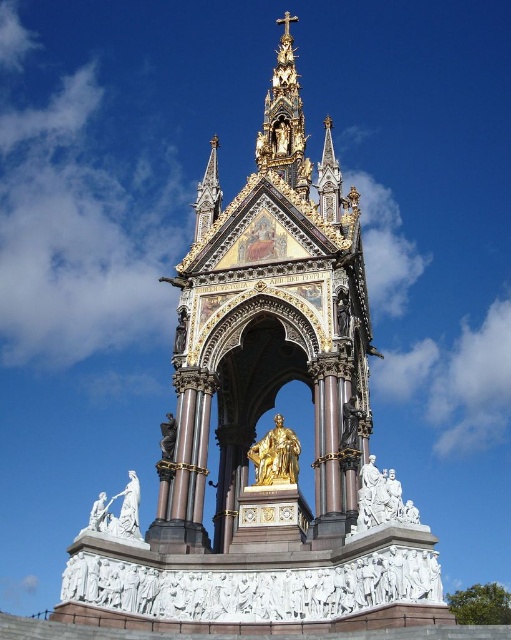
You are an art student analyzing the Albert Memorial. You observe the white marble statue at lower left and the bronze statue at center. Which statue has a greater width?

The white marble statue at lower left has a greater width than the bronze statue at center.

You are standing at the entrance of the Albert Memorial and see the white marble statues at lower right and the white marble statue at lower left. Which one is closer to you?

The white marble statues at lower right is closer to you because it is in front of the white marble statue at lower left.

You are a tourist standing at the entrance of the Albert Memorial. You see the white marble statue at lower left and the bronze statue at center. Which statue is closer to you?

The white marble statue at lower left is closer to you since it is in front of the bronze statue at center.